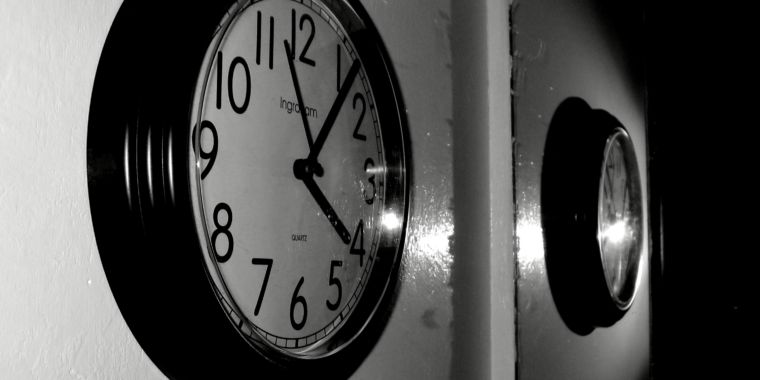
Locate an element on the screen. clock hands is located at coordinates (328, 116), (302, 109), (325, 212), (608, 191), (625, 202).